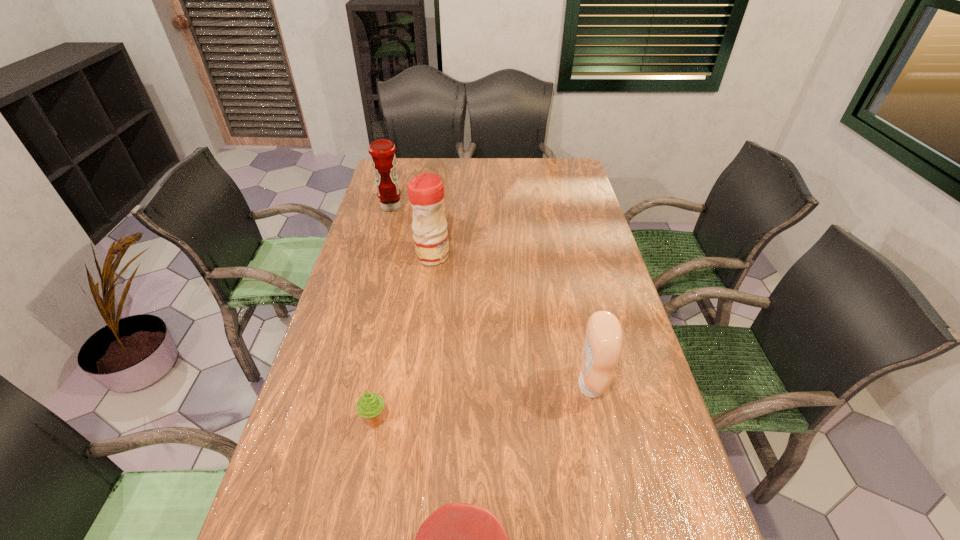
In the image, there is a desktop. Where is `vacant region at the far right corner`? The height and width of the screenshot is (540, 960). vacant region at the far right corner is located at coordinates (551, 173).

Locate an element on the screen. vacant point located between the fourth farthest object and the leftmost object is located at coordinates (383, 314).

Locate an element on the screen. This screenshot has width=960, height=540. vacant point located between the farthest condiment and the third farthest object is located at coordinates (491, 296).

Identify the location of free space between the second farthest condiment and the leftmost object. (412, 232).

You are a GUI agent. You are given a task and a screenshot of the screen. Output one action in this format:
    pyautogui.click(x=<x>, y=<y>)
    Task: Click on the empty space between the second farthest object and the icecream
    The width and height of the screenshot is (960, 540).
    Given the screenshot: What is the action you would take?
    pyautogui.click(x=404, y=339)

At what (x,y) coordinates should I click in order to perform the action: click on empty space that is in between the farthest object and the second shortest object. Please return your answer as a coordinate pair (x, y). This screenshot has height=540, width=960. Looking at the image, I should click on (383, 314).

Find the location of a particular element. This screenshot has width=960, height=540. vacant region between the second farthest object and the nearest condiment is located at coordinates (512, 321).

At what (x,y) coordinates should I click in order to perform the action: click on free space between the fourth nearest object and the leftmost condiment. Please return your answer as a coordinate pair (x, y). The width and height of the screenshot is (960, 540). Looking at the image, I should click on (412, 232).

Identify which object is the second nearest to the nearest object. Please provide its 2D coordinates. Your answer should be formatted as a tuple, i.e. [(x, y)], where the tuple contains the x and y coordinates of a point satisfying the conditions above.

[(602, 348)]

You are a GUI agent. You are given a task and a screenshot of the screen. Output one action in this format:
    pyautogui.click(x=<x>, y=<y>)
    Task: Click on the object that is the third closest to the rightmost object
    
    Given the screenshot: What is the action you would take?
    coord(425,191)